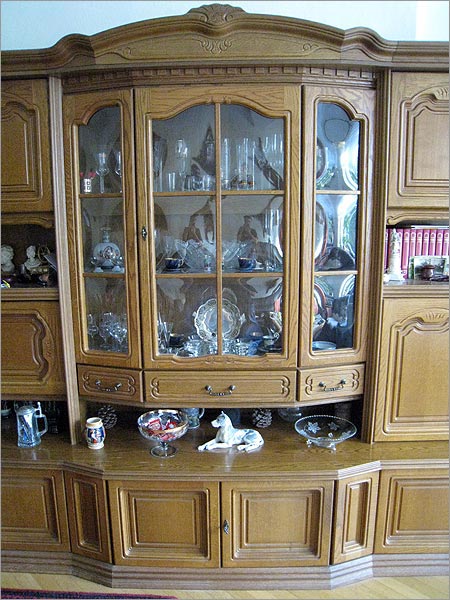
You are a GUI agent. You are given a task and a screenshot of the screen. Output one action in this format:
    pyautogui.click(x=<x>, y=<y>)
    Task: Click on the teacup
    
    Given the screenshot: What is the action you would take?
    pyautogui.click(x=243, y=264)